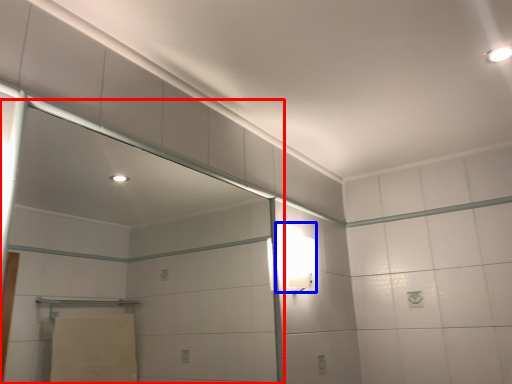
Question: Which object is further to the camera taking this photo, screen door (highlighted by a red box) or light fixture (highlighted by a blue box)?

Choices:
 (A) screen door
 (B) light fixture

Answer: (B)